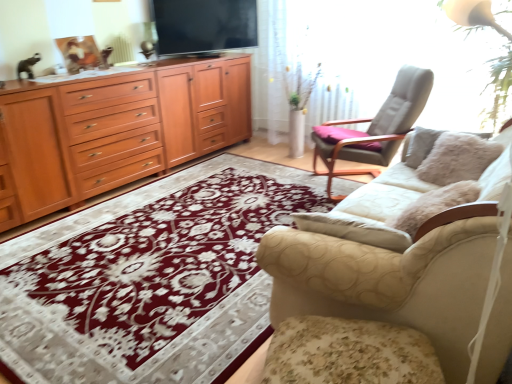
Image resolution: width=512 pixels, height=384 pixels. What do you see at coordinates (149, 278) in the screenshot?
I see `floral carpet at center` at bounding box center [149, 278].

Measure the distance between wooden cabinet at left and camera.

12.07 feet.

Find the location of a particular element. Image resolution: width=512 pixels, height=384 pixels. floral fabric footrest at lower right is located at coordinates (349, 353).

Image resolution: width=512 pixels, height=384 pixels. What are the coordinates of `light gray fabric chair at upper right` in the screenshot? It's located at (374, 128).

Find the location of `beige fabric couch at right`. beige fabric couch at right is located at coordinates (376, 304).

I want to click on floral carpet at center, so click(149, 278).

Between floral fabric footrest at lower right and beige fabric couch at right, which one has more height?

Standing taller between the two is beige fabric couch at right.

Are floral fabric footrest at lower right and beige fabric couch at right far apart?

floral fabric footrest at lower right is actually quite close to beige fabric couch at right.

Is point (406, 340) more distant than point (327, 312)?

No, it is in front of (327, 312).

Which object is further away from the camera taking this photo, floral fabric footrest at lower right or beige fabric couch at right?

floral fabric footrest at lower right is further from the camera.

Consider the image. Would you consider wooden cabinet at left to be distant from floral carpet at center?

Yes.

Which object is more forward, wooden cabinet at left or floral carpet at center?

floral carpet at center is more forward.

Where is `mat below the wooden cabinet at left (from the image's perspective)`? Image resolution: width=512 pixels, height=384 pixels. mat below the wooden cabinet at left (from the image's perspective) is located at coordinates (149, 278).

Which is further, (194, 147) or (48, 340)?

The point (194, 147) is farther from the camera.

Consider the image. Is wooden drawer at left inside the boundaries of flat screen tv at upper center, or outside?

The correct answer is: outside.

From the image's perspective, which object appears higher, wooden drawer at left or flat screen tv at upper center?

flat screen tv at upper center is shown above in the image.

From the picture: Is wooden drawer at left with flat screen tv at upper center?

No, wooden drawer at left is not in contact with flat screen tv at upper center.

From the image's perspective, is beige fabric couch at right under flat screen tv at upper center?

Indeed, from the image's perspective, beige fabric couch at right is shown beneath flat screen tv at upper center.

Does point (301, 368) come farther from viewer compared to point (230, 46)?

No, it is not.

Is beige fabric couch at right oriented away from flat screen tv at upper center?

beige fabric couch at right does not have its back to flat screen tv at upper center.

Which object is positioned more to the left, light gray fabric chair at upper right or floral carpet at center?

floral carpet at center is more to the left.

Considering the sizes of objects light gray fabric chair at upper right and floral carpet at center in the image provided, who is bigger, light gray fabric chair at upper right or floral carpet at center?

light gray fabric chair at upper right is bigger.

Which object is closer to the camera taking this photo, light gray fabric chair at upper right or floral carpet at center?

floral carpet at center is more forward.

Is point (357, 141) in front of point (143, 240)?

No, (357, 141) is behind (143, 240).

Where is `mat lying below the wooden cabinet at left (from the image's perspective)`? Image resolution: width=512 pixels, height=384 pixels. mat lying below the wooden cabinet at left (from the image's perspective) is located at coordinates (149, 278).

Is floral carpet at center next to wooden cabinet at left and touching it?

There is a gap between floral carpet at center and wooden cabinet at left.

Which is more to the left, floral carpet at center or wooden cabinet at left?

Positioned to the left is wooden cabinet at left.

Is wooden cabinet at left facing towards beige fabric couch at right?

Yes, wooden cabinet at left is oriented towards beige fabric couch at right.

Is wooden cabinet at left touching beige fabric couch at right?

wooden cabinet at left and beige fabric couch at right are not in contact.

Between wooden cabinet at left and beige fabric couch at right, which one has smaller width?

wooden cabinet at left.

Is the position of wooden cabinet at left less distant than that of beige fabric couch at right?

No, wooden cabinet at left is further to the viewer.

This screenshot has width=512, height=384. Identify the location of studio couch in front of the floral fabric footrest at lower right. (376, 304).

You are a GUI agent. You are given a task and a screenshot of the screen. Output one action in this format:
    pyautogui.click(x=<x>, y=<y>)
    Task: Click on the tv cabinet that appears behind the floral carpet at center
    This screenshot has height=384, width=512.
    Given the screenshot: What is the action you would take?
    pyautogui.click(x=204, y=107)

Considering their positions, is wooden drawer at left positioned closer to flat screen tv at upper center than light gray fabric chair at upper right?

wooden drawer at left lies closer to flat screen tv at upper center than the other object.

Based on their spatial positions, is flat screen tv at upper center or floral fabric footrest at lower right closer to wooden drawer at left?

Based on the image, flat screen tv at upper center appears to be nearer to wooden drawer at left.

Looking at the image, which one is located closer to light gray fabric chair at upper right, flat screen tv at upper center or wooden drawer at left?

flat screen tv at upper center.

Based on their spatial positions, is floral carpet at center or flat screen tv at upper center closer to floral fabric footrest at lower right?

Among the two, floral carpet at center is located nearer to floral fabric footrest at lower right.

From the image, which object appears to be nearer to floral fabric footrest at lower right, floral carpet at center or beige fabric couch at right?

Based on the image, beige fabric couch at right appears to be nearer to floral fabric footrest at lower right.

Which object lies nearer to the anchor point beige fabric couch at right, wooden drawer at left or wooden cabinet at left?

wooden drawer at left is closer to beige fabric couch at right.

When comparing their distances from wooden cabinet at left, does floral carpet at center or beige fabric couch at right seem closer?

Among the two, floral carpet at center is located nearer to wooden cabinet at left.

Which object lies further to the anchor point beige fabric couch at right, light gray fabric chair at upper right or wooden drawer at left?

wooden drawer at left is further to beige fabric couch at right.

Locate an element on the screen. The image size is (512, 384). mat located between beige fabric couch at right and flat screen tv at upper center in the depth direction is located at coordinates 149,278.

Locate an element on the screen. tv cabinet between flat screen tv at upper center and wooden drawer at left in the up-down direction is located at coordinates (204, 107).

Locate an element on the screen. The image size is (512, 384). mat positioned between floral fabric footrest at lower right and flat screen tv at upper center from near to far is located at coordinates (149, 278).

This screenshot has width=512, height=384. Find the location of `chair between beige fabric couch at right and wooden cabinet at left along the z-axis`. chair between beige fabric couch at right and wooden cabinet at left along the z-axis is located at coordinates (374, 128).